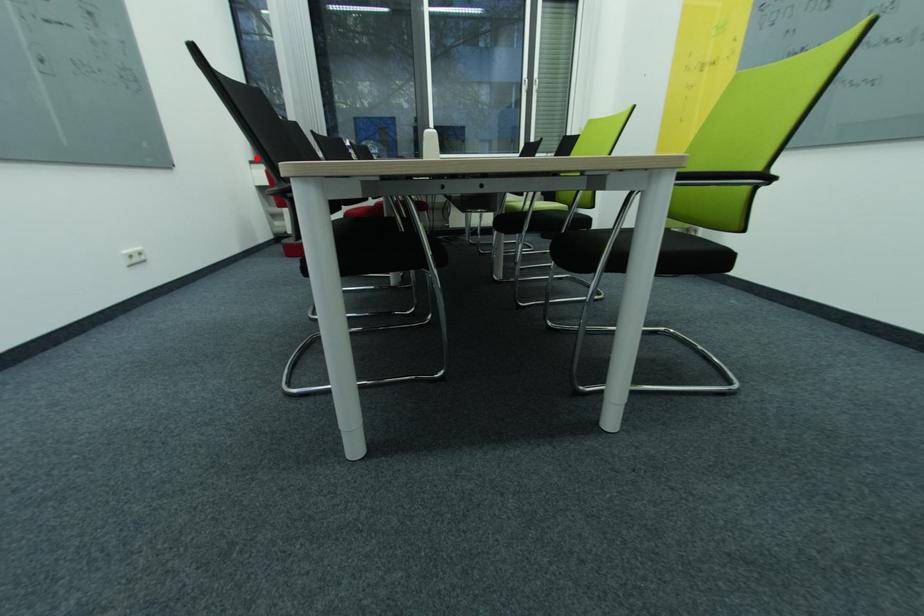
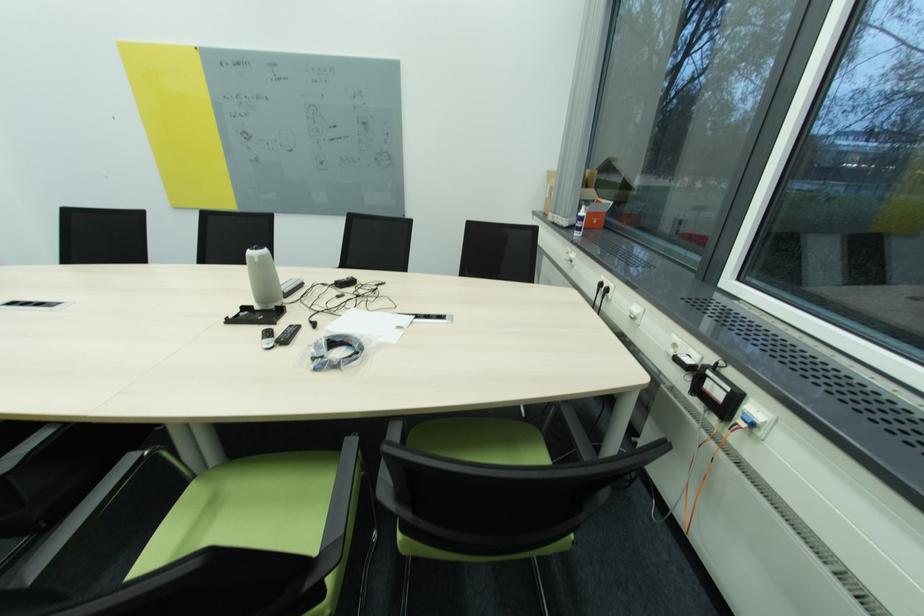
Question: I am providing you with two images of the same scene from different viewpoints. Given a red point in image1, look at the same physical point in image2. Is it:

Choices:
 (A) Closer to the viewpoint
 (B) Farther from the viewpoint

Answer: (B)